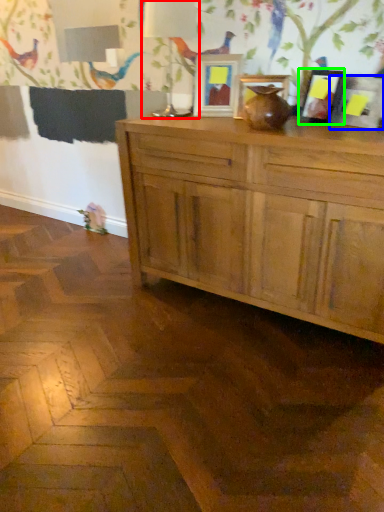
Question: Based on their relative distances, which object is farther from table lamp (highlighted by a red box)? Choose from picture frame (highlighted by a blue box) and picture frame (highlighted by a green box).

Choices:
 (A) picture frame
 (B) picture frame

Answer: (A)